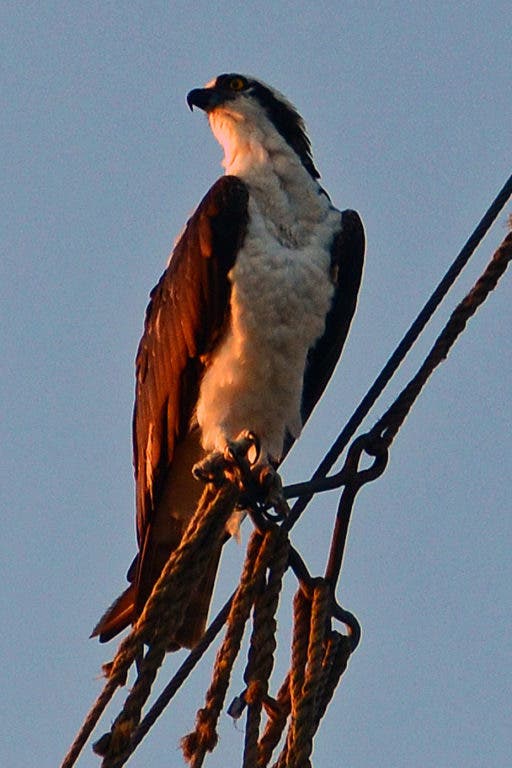
This screenshot has height=768, width=512. I want to click on chest, so click(273, 322).